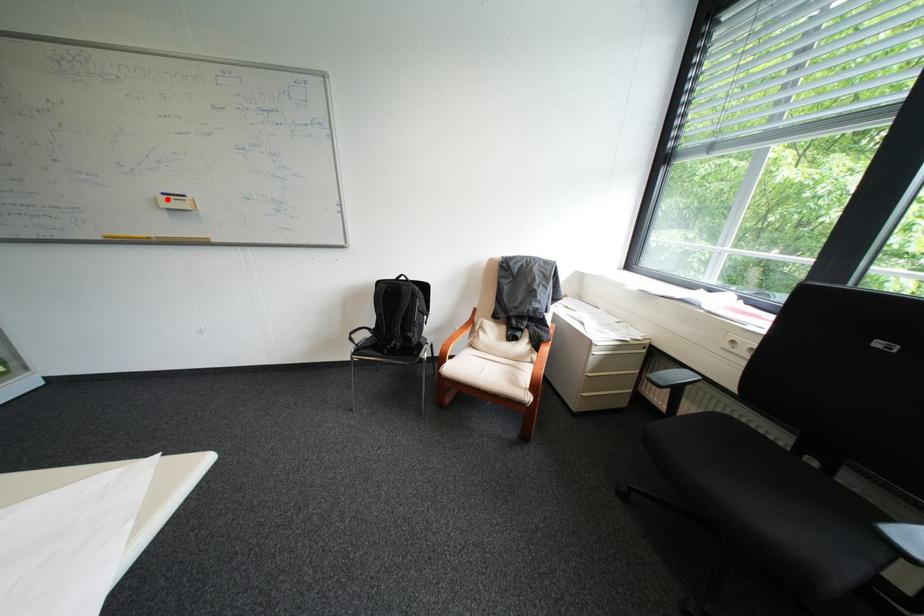
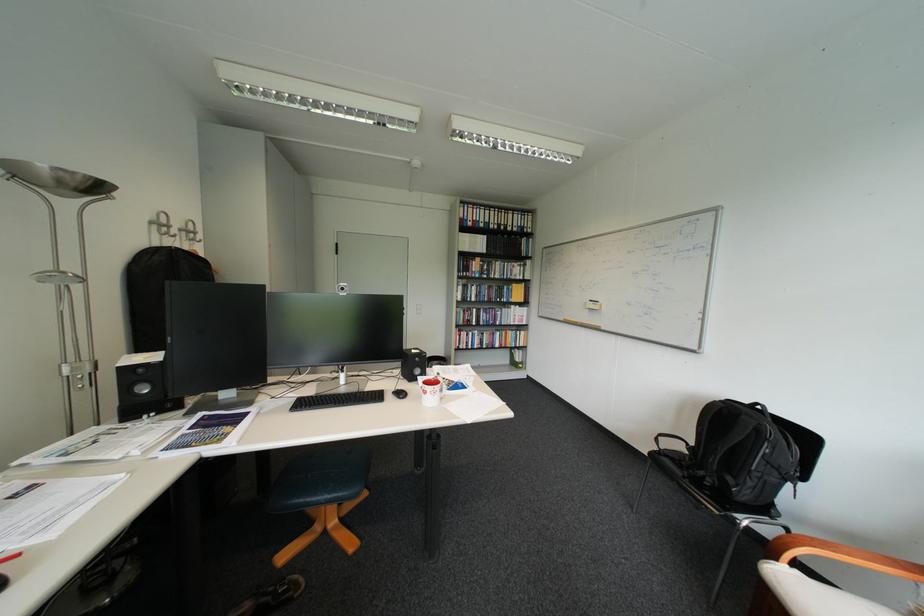
Where in the second image is the point corresponding to the highlighted location from the first image?

(598, 304)